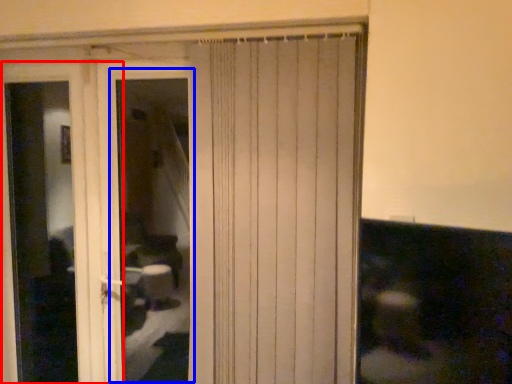
Question: Which object appears closest to the camera in this image, screen door (highlighted by a red box) or window (highlighted by a blue box)?

Choices:
 (A) screen door
 (B) window

Answer: (B)